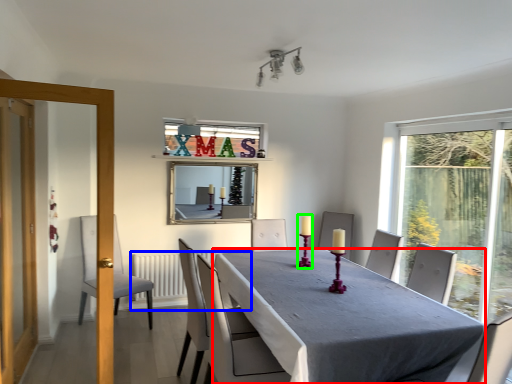
Question: Which object is positioned closest to table (highlighted by a red box)? Select from radiator (highlighted by a blue box) and candle holder (highlighted by a green box).

Choices:
 (A) radiator
 (B) candle holder

Answer: (B)